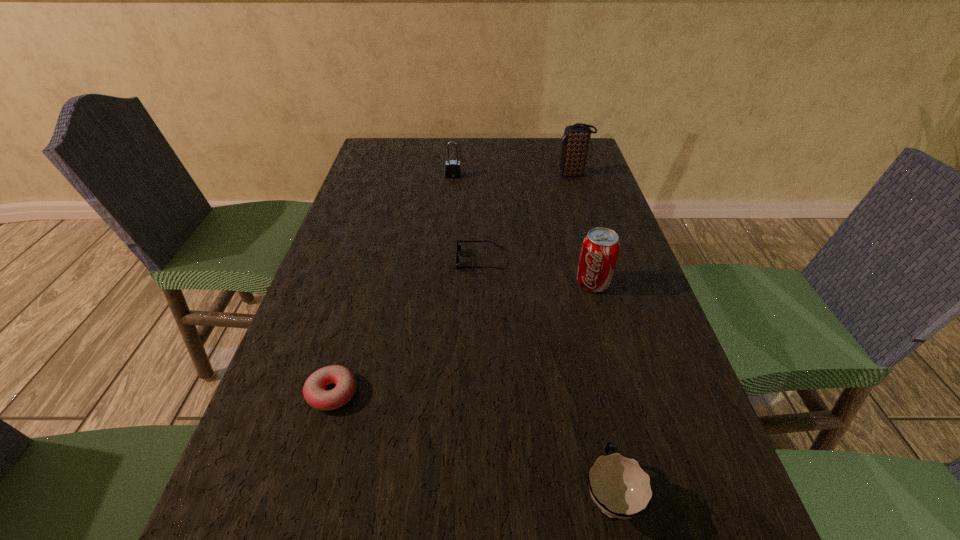
Identify the location of clutch bag. (576, 138).

The width and height of the screenshot is (960, 540). Find the location of `soda`. soda is located at coordinates (600, 249).

The width and height of the screenshot is (960, 540). I want to click on padlock, so click(x=453, y=167).

Where is `the nearest object`? This screenshot has width=960, height=540. the nearest object is located at coordinates (621, 488).

This screenshot has width=960, height=540. What are the coordinates of `cup` in the screenshot? It's located at (621, 488).

Image resolution: width=960 pixels, height=540 pixels. I want to click on sunglasses, so click(458, 246).

Locate an element on the screen. The height and width of the screenshot is (540, 960). doughnut is located at coordinates (314, 392).

Locate an element on the screen. the leftmost object is located at coordinates (314, 392).

The height and width of the screenshot is (540, 960). I want to click on free space located with the zip open on the clutch bag, so click(482, 174).

Find the location of `free region located 0.190m with the zip open on the clutch bag`. free region located 0.190m with the zip open on the clutch bag is located at coordinates (497, 174).